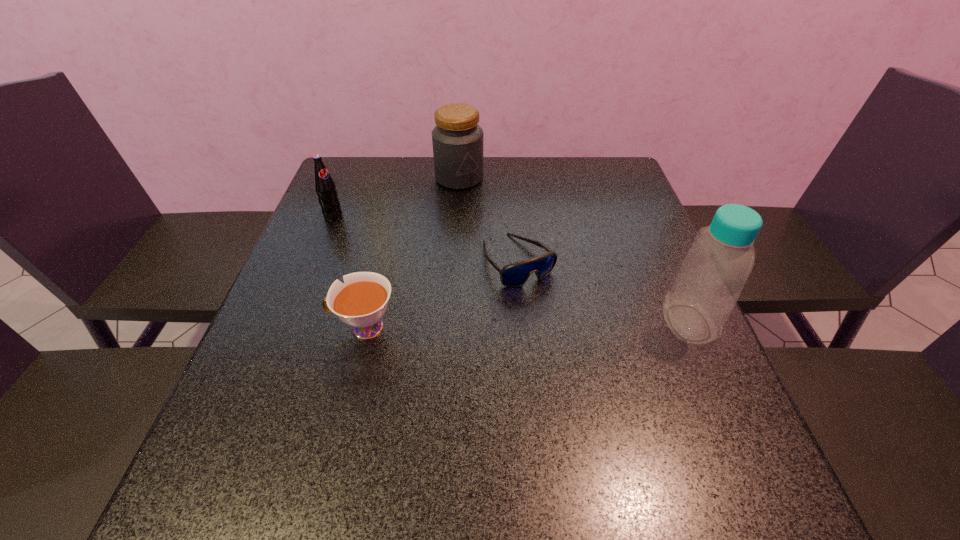
At what (x,y) coordinates should I click in order to perform the action: click on free space on the desktop that is between the second object from left to right and the tallest object and is positioned on the front label of the third shortest object. Please return your answer as a coordinate pair (x, y). This screenshot has height=540, width=960. Looking at the image, I should click on (496, 326).

Find the location of a particular element. This screenshot has height=540, width=960. free space on the desktop that is between the fourth object from right to left and the rightmost object and is positioned on the surface of the jar near the warning symbol is located at coordinates (550, 325).

The image size is (960, 540). What are the coordinates of `vacant space on the desktop that is between the teacup and the bottle and is positioned on the front-facing side of the shortest object` in the screenshot? It's located at (568, 325).